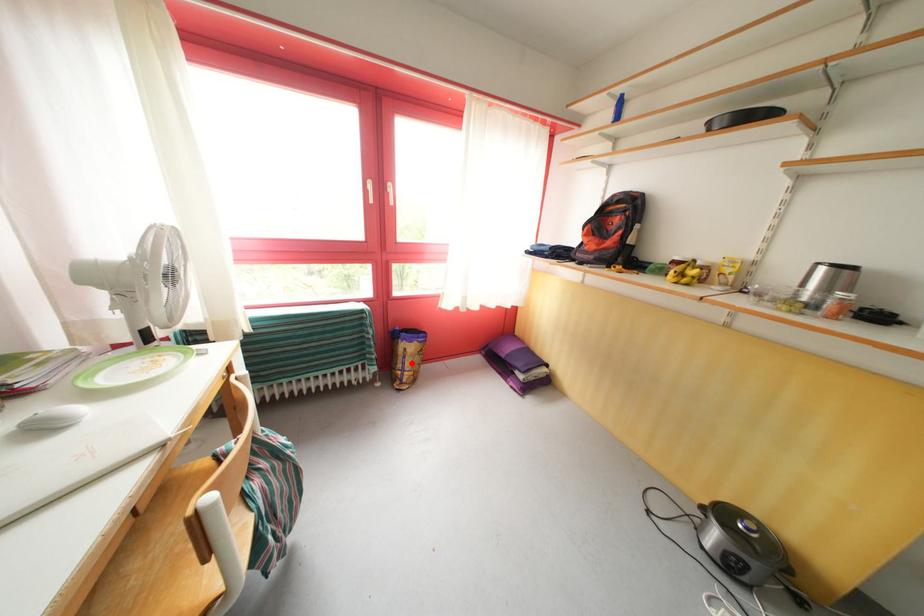
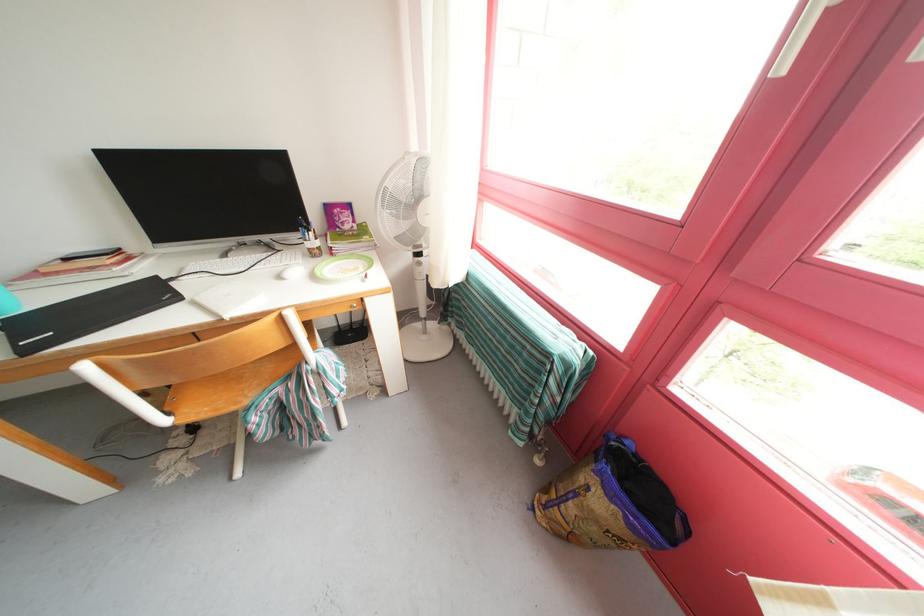
Locate, in the second image, the point that corresponds to the highlighted location in the first image.

(582, 499)